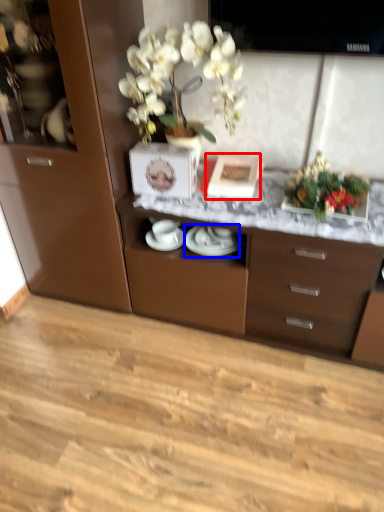
Question: Which object is further to the camera taking this photo, picture frame (highlighted by a red box) or tableware (highlighted by a blue box)?

Choices:
 (A) picture frame
 (B) tableware

Answer: (B)